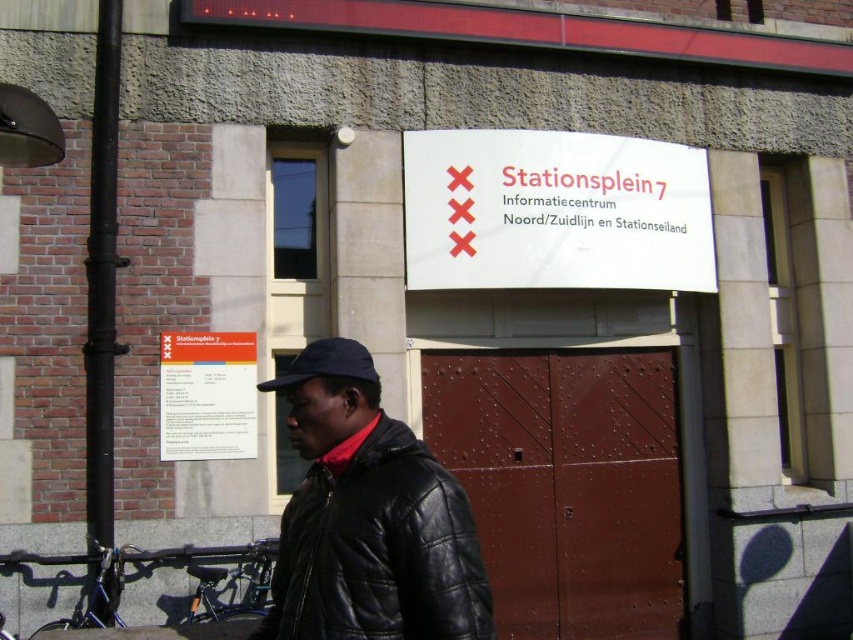
Question: Considering the real-world distances, which object is farthest from the matte blue cap at center?

Choices:
 (A) white paper sign at center
 (B) white paper sign at upper center
 (C) black leather jacket at lower left

Answer: (C)

Question: Among these objects, which one is nearest to the camera?

Choices:
 (A) black leather jacket at lower left
 (B) matte blue cap at center
 (C) white paper sign at center

Answer: (A)

Question: Can you confirm if black leather jacket at lower left is positioned below white paper sign at upper center?

Choices:
 (A) no
 (B) yes

Answer: (B)

Question: Which point appears farthest from the camera in this image?

Choices:
 (A) (233, 433)
 (B) (260, 384)
 (C) (422, 282)

Answer: (C)

Question: Does white paper sign at center have a greater width compared to white paper sign at upper center?

Choices:
 (A) yes
 (B) no

Answer: (A)

Question: Does white paper sign at center appear under white paper sign at upper center?

Choices:
 (A) no
 (B) yes

Answer: (A)